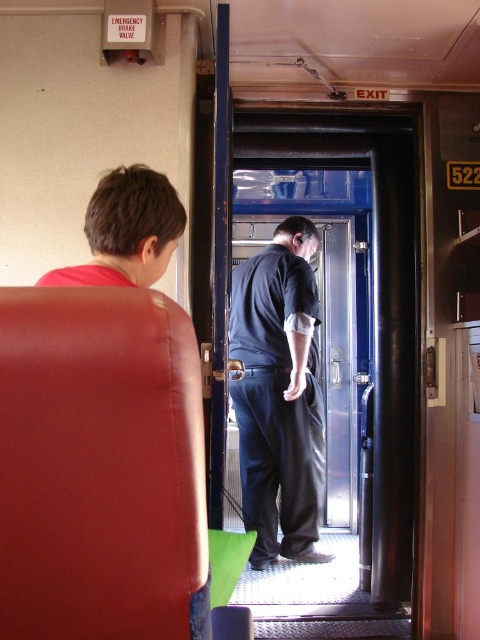
Who is shorter, matte leather seat at left or red shirt at left?

red shirt at left is shorter.

Can you confirm if matte leather seat at left is shorter than red shirt at left?

No, matte leather seat at left is not shorter than red shirt at left.

Is point (129, 356) farther from viewer compared to point (163, 221)?

That is False.

You are a GUI agent. You are given a task and a screenshot of the screen. Output one action in this format:
    pyautogui.click(x=<x>, y=<y>)
    Task: Click on the matte leather seat at left
    The height and width of the screenshot is (640, 480).
    Given the screenshot: What is the action you would take?
    pyautogui.click(x=99, y=467)

Does matte leather seat at left have a larger size compared to dark blue jeans at center?

No, matte leather seat at left is not bigger than dark blue jeans at center.

Who is positioned more to the right, matte leather seat at left or dark blue jeans at center?

Positioned to the right is dark blue jeans at center.

Is point (117, 492) farther from camera compared to point (317, 432)?

No, (117, 492) is closer to viewer.

You are a GUI agent. You are given a task and a screenshot of the screen. Output one action in this format:
    pyautogui.click(x=<x>, y=<y>)
    Task: Click on the matte leather seat at left
    The width and height of the screenshot is (480, 640).
    Given the screenshot: What is the action you would take?
    pyautogui.click(x=99, y=467)

Who is lower down, dark blue jeans at center or red shirt at left?

dark blue jeans at center is below.

This screenshot has height=640, width=480. What do you see at coordinates (278, 394) in the screenshot?
I see `dark blue jeans at center` at bounding box center [278, 394].

Is point (291, 385) less distant than point (162, 173)?

No, it is behind (162, 173).

Where is `dark blue jeans at center`? dark blue jeans at center is located at coordinates (278, 394).